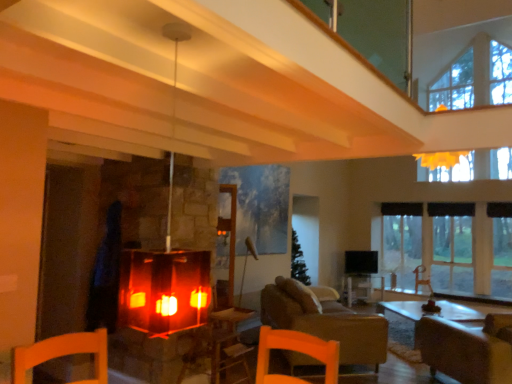
Question: Can you confirm if wooden table at center is thinner than black fabric curtain at right?

Choices:
 (A) no
 (B) yes

Answer: (A)

Question: Considering the relative positions of wooden table at center and black fabric curtain at right in the image provided, is wooden table at center to the left of black fabric curtain at right from the viewer's perspective?

Choices:
 (A) yes
 (B) no

Answer: (A)

Question: Is wooden table at center completely or partially outside of black fabric curtain at right?

Choices:
 (A) no
 (B) yes

Answer: (B)

Question: Does wooden table at center have a lesser height compared to black fabric curtain at right?

Choices:
 (A) yes
 (B) no

Answer: (B)

Question: From the image's perspective, does wooden table at center appear higher than black fabric curtain at right?

Choices:
 (A) yes
 (B) no

Answer: (B)

Question: Does wooden table at center turn towards black fabric curtain at right?

Choices:
 (A) yes
 (B) no

Answer: (B)

Question: Is leather couch at center completely or partially inside brown leather armchair at lower right, the 1th armchair from the front?

Choices:
 (A) yes
 (B) no

Answer: (B)

Question: From a real-world perspective, is brown leather armchair at lower right, the second armchair positioned from the right, on top of leather couch at center?

Choices:
 (A) no
 (B) yes

Answer: (B)

Question: Can you confirm if brown leather armchair at lower right, the second armchair positioned from the right, is thinner than leather couch at center?

Choices:
 (A) no
 (B) yes

Answer: (A)

Question: Is the position of brown leather armchair at lower right, the second armchair positioned from the right, more distant than that of leather couch at center?

Choices:
 (A) no
 (B) yes

Answer: (A)

Question: Is the depth of brown leather armchair at lower right, the 1th armchair from the front, less than that of leather couch at center?

Choices:
 (A) yes
 (B) no

Answer: (A)

Question: From a real-world perspective, is brown leather armchair at lower right, the second armchair positioned from the right, positioned under leather couch at center based on gravity?

Choices:
 (A) yes
 (B) no

Answer: (B)

Question: Does transparent glass window at right have a larger size compared to black fabric curtain at right?

Choices:
 (A) no
 (B) yes

Answer: (B)